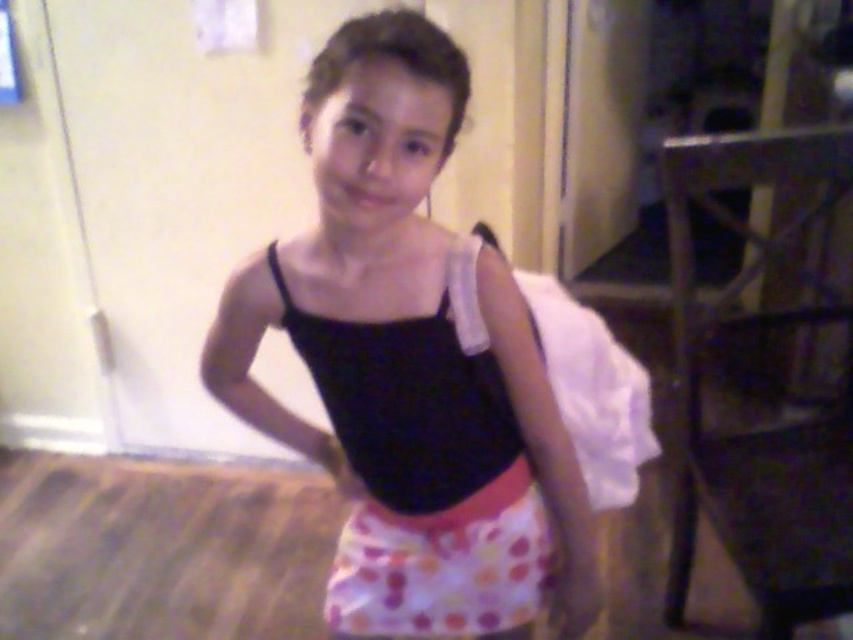
Question: Does matte black leotard at center appear on the left side of polka dot fabric skirt at center?

Choices:
 (A) yes
 (B) no

Answer: (A)

Question: Which object is the closest to the black spandex leotard at center?

Choices:
 (A) polka dot fabric skirt at center
 (B) matte black leotard at center

Answer: (B)

Question: In this image, where is matte black leotard at center located relative to polka dot fabric skirt at center?

Choices:
 (A) above
 (B) below

Answer: (A)

Question: Which object is farther from the camera taking this photo?

Choices:
 (A) matte black leotard at center
 (B) polka dot fabric skirt at center
 (C) black spandex leotard at center

Answer: (B)

Question: Can you confirm if matte black leotard at center is bigger than polka dot fabric skirt at center?

Choices:
 (A) no
 (B) yes

Answer: (B)

Question: Which of the following is the closest to the observer?

Choices:
 (A) (525, 513)
 (B) (558, 506)
 (C) (500, 465)

Answer: (B)